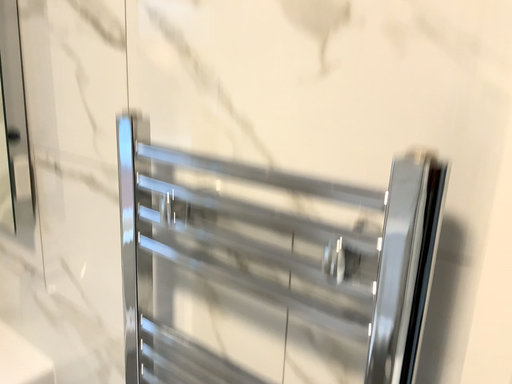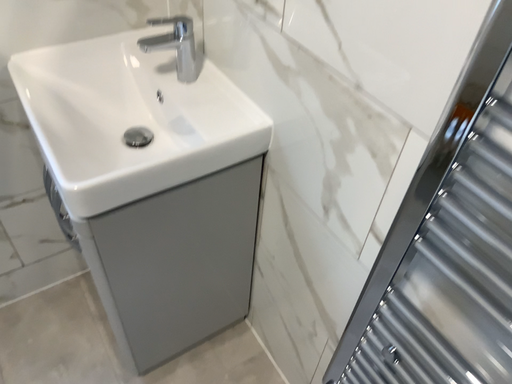
Question: How did the camera likely rotate when shooting the video?

Choices:
 (A) rotated downward
 (B) rotated upward

Answer: (A)